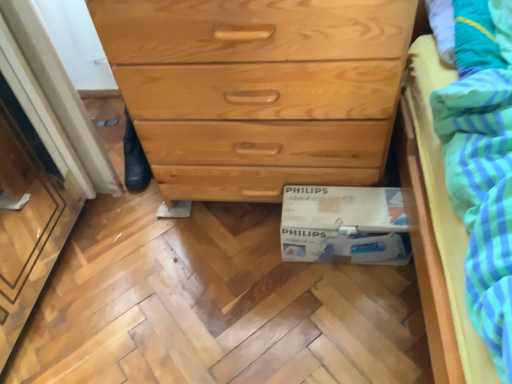
At what (x,y) coordinates should I click in order to perform the action: click on empty space that is ontop of white cardboard box at lower center (from a real-world perspective). Please return your answer as a coordinate pair (x, y). Image resolution: width=512 pixels, height=384 pixels. Looking at the image, I should click on (339, 207).